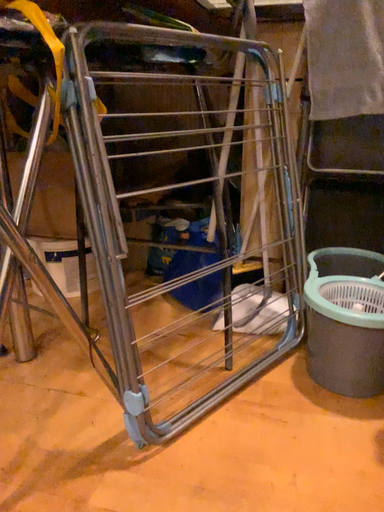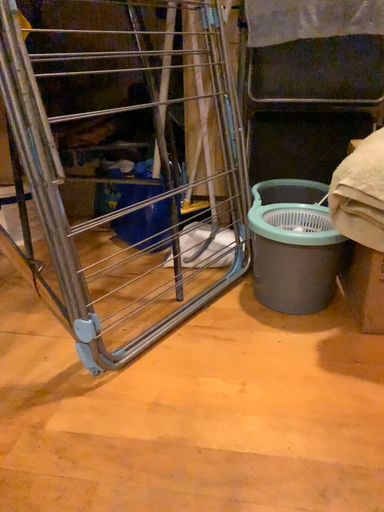
Question: How did the camera likely rotate when shooting the video?

Choices:
 (A) rotated right
 (B) rotated left

Answer: (A)